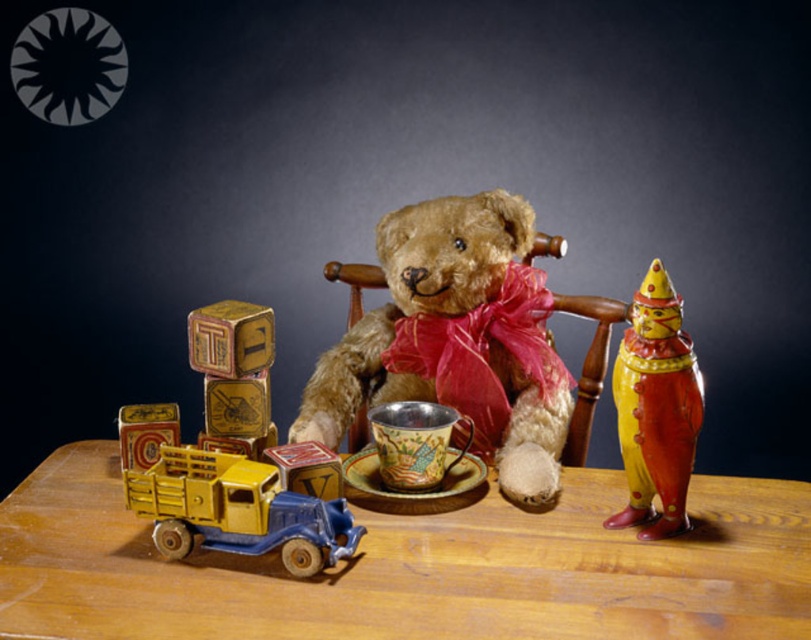
You are a photographer standing at the camera position. You want to take a photo of the soft brown teddy bear at center. Is the teddy bear within your camera frame?

The soft brown teddy bear at center and camera are 3.69 feet apart from each other. Assuming a typical camera lens with a standard focal length, the teddy bear would likely be within the frame as 3.69 feet is a reasonable distance for capturing a subject like a teddy bear in a photograph.